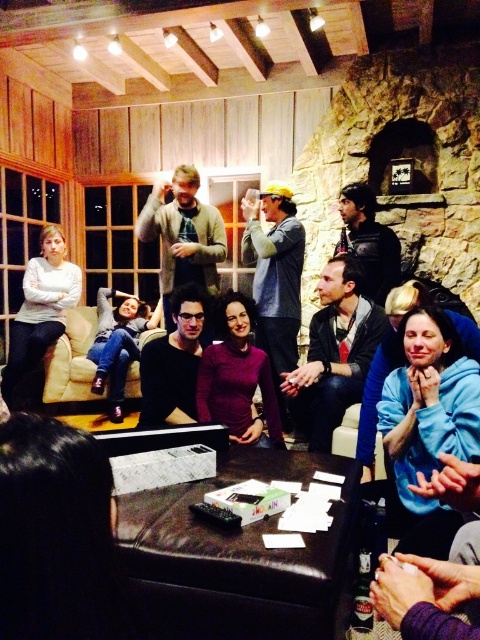
Does beige fabric couch at lower left appear under leather jacket at upper center?

Yes.

Is the position of beige fabric couch at lower left less distant than that of leather jacket at upper center?

That is False.

Image resolution: width=480 pixels, height=640 pixels. I want to click on beige fabric couch at lower left, so click(72, 360).

Looking at this image, can you confirm if knitted sweater at center is positioned above matte white sweater at left?

Correct, knitted sweater at center is located above matte white sweater at left.

Can you confirm if knitted sweater at center is positioned to the right of matte white sweater at left?

Correct, you'll find knitted sweater at center to the right of matte white sweater at left.

The height and width of the screenshot is (640, 480). I want to click on knitted sweater at center, so click(x=182, y=236).

Which is more to the left, black matte shirt at center or beige fabric couch at lower left?

beige fabric couch at lower left

You are a GUI agent. You are given a task and a screenshot of the screen. Output one action in this format:
    pyautogui.click(x=<x>, y=<y>)
    Task: Click on the black matte shirt at center
    The width and height of the screenshot is (480, 640).
    Given the screenshot: What is the action you would take?
    pyautogui.click(x=173, y=362)

Describe the element at coordinates (173, 362) in the screenshot. I see `black matte shirt at center` at that location.

Locate an element on the screen. Image resolution: width=480 pixels, height=640 pixels. black matte shirt at center is located at coordinates (173, 362).